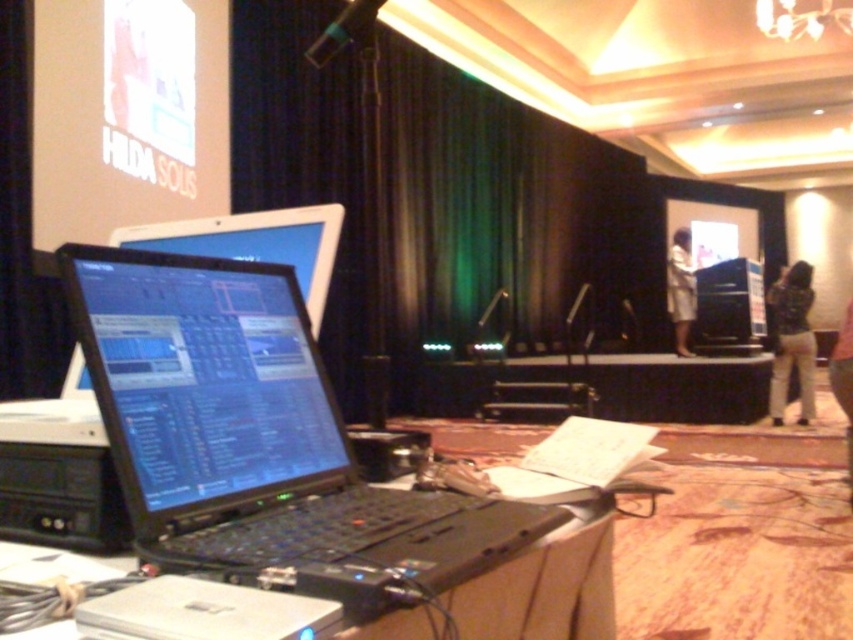
You are standing in the room and want to place a new laptop on the table. The table is at point (375,598). Can you tell me the exact coordinates of the table where you should place the laptop?

The black plastic table at lower left is located at point (375,598), so you should place the laptop there at those coordinates.

You are an event organizer setting up a presentation stage. You have two fabrics, the black fabric curtain at center and the white fabric at center. Which fabric should you choose if you want to create a more dramatic backdrop that covers the entire stage height?

The black fabric curtain at center is much taller than the white fabric at center, so it would be the better choice for creating a dramatic backdrop that covers the entire stage height.

You are standing at the point labeled point (283, 13) in a dimly lit room with a presentation stage setup. You want to take a photo of the stage using a camera that has a minimum focusing distance of 5 meters. Can you take a clear photo of the stage from your current position?

The distance between point (283, 13) and the camera is 5.43 meters. Since the camera requires a minimum focusing distance of 5 meters, you can take a clear photo of the stage from your current position because the distance is sufficient.